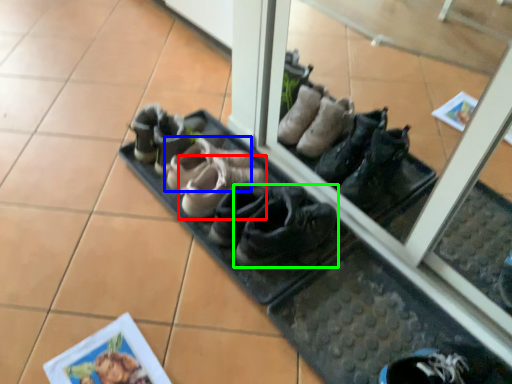
Question: Estimate the real-world distances between objects in this image. Which object is farther from footwear (highlighted by a red box), footwear (highlighted by a blue box) or footwear (highlighted by a green box)?

Choices:
 (A) footwear
 (B) footwear

Answer: (B)